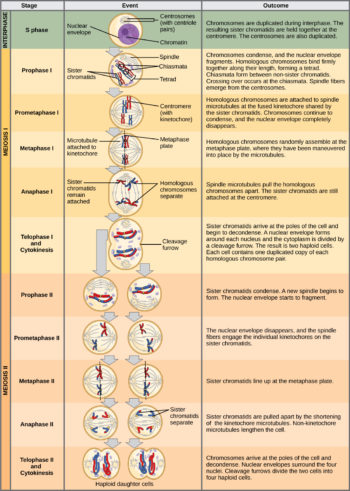
The height and width of the screenshot is (491, 350). In order to click on column in this screenshot , I will do `click(4, 26)`.